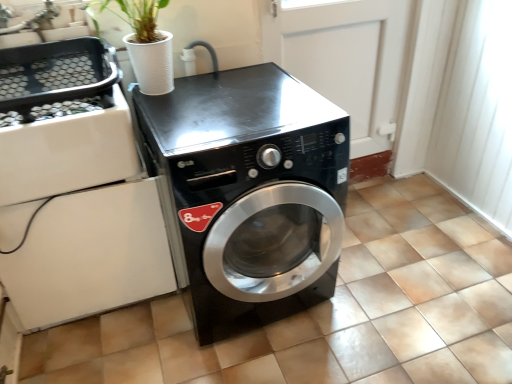
Question: Considering their positions, is black glossy washing machine at center located in front of or behind white glossy door at center?

Choices:
 (A) behind
 (B) front

Answer: (B)

Question: From a real-world perspective, relative to white glossy door at center, is black glossy washing machine at center vertically above or below?

Choices:
 (A) below
 (B) above

Answer: (A)

Question: Based on their positions, is black glossy washing machine at center located to the left or right of white glossy door at center?

Choices:
 (A) left
 (B) right

Answer: (A)

Question: Considering the positions of point (355, 130) and point (173, 107), is point (355, 130) closer or farther from the camera than point (173, 107)?

Choices:
 (A) closer
 (B) farther

Answer: (B)

Question: In terms of width, does white glossy door at center look wider or thinner when compared to black glossy washing machine at center?

Choices:
 (A) thin
 (B) wide

Answer: (A)

Question: Is white glossy door at center inside the boundaries of black glossy washing machine at center, or outside?

Choices:
 (A) outside
 (B) inside

Answer: (A)

Question: Looking at the image, does white glossy door at center seem bigger or smaller compared to black glossy washing machine at center?

Choices:
 (A) big
 (B) small

Answer: (B)